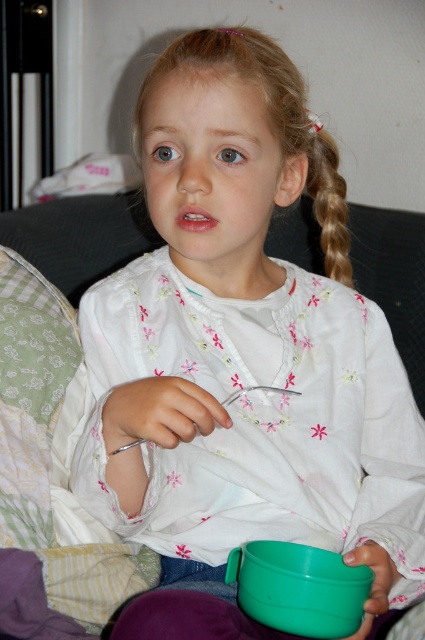
Question: Observing the image, what is the correct spatial positioning of green plastic bowl at lower center in reference to blonde hair at upper right?

Choices:
 (A) left
 (B) right

Answer: (A)

Question: Does green plastic bowl at lower center appear under blonde hair at upper right?

Choices:
 (A) no
 (B) yes

Answer: (B)

Question: Which of the following is the closest to the observer?

Choices:
 (A) (365, 589)
 (B) (320, 177)

Answer: (A)

Question: Does green plastic bowl at lower center lie in front of blonde hair at upper right?

Choices:
 (A) yes
 (B) no

Answer: (A)